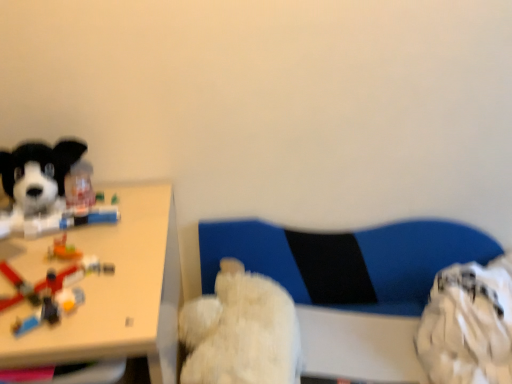
Identify the location of empty space that is ontop of white plastic table at left (from a real-world perspective). (65, 249).